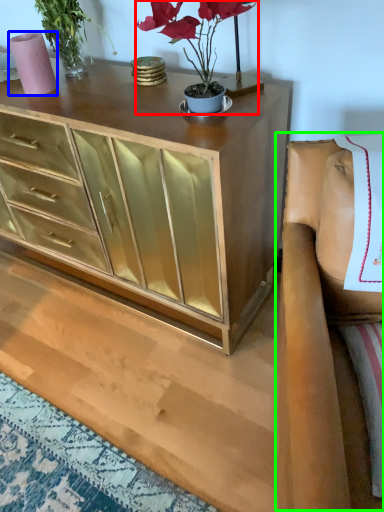
Question: Which object is the closest to the houseplant (highlighted by a red box)? Choose among these: vase (highlighted by a blue box) or armchair (highlighted by a green box).

Choices:
 (A) vase
 (B) armchair

Answer: (B)